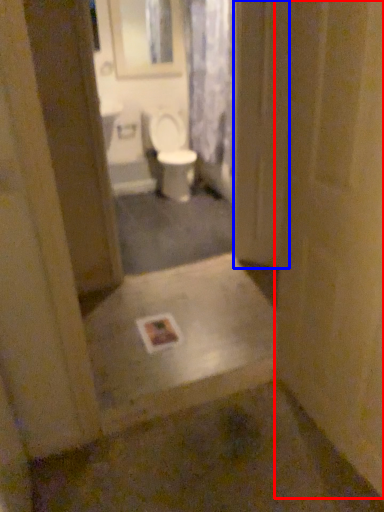
Question: Which object appears farthest to the camera in this image, door (highlighted by a red box) or screen door (highlighted by a blue box)?

Choices:
 (A) door
 (B) screen door

Answer: (B)